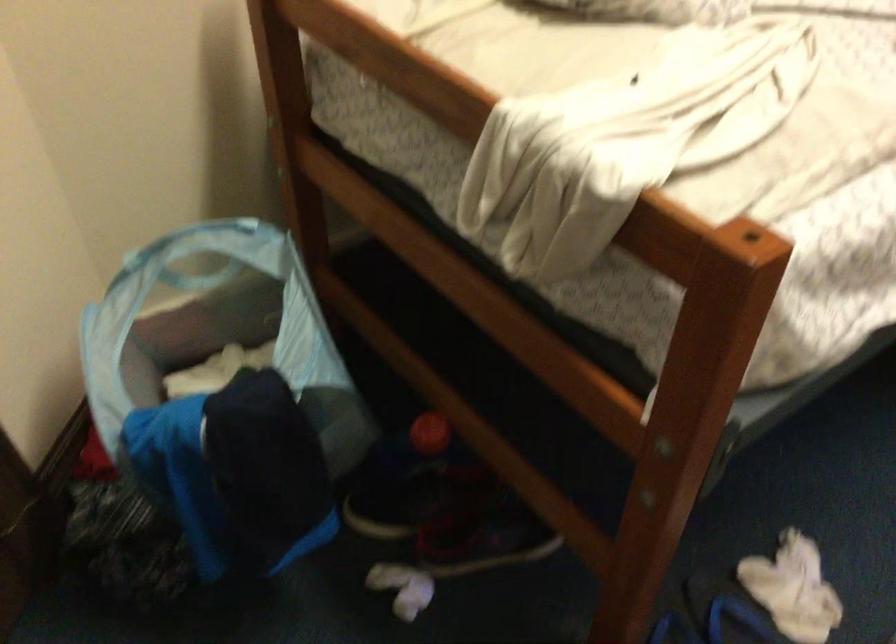
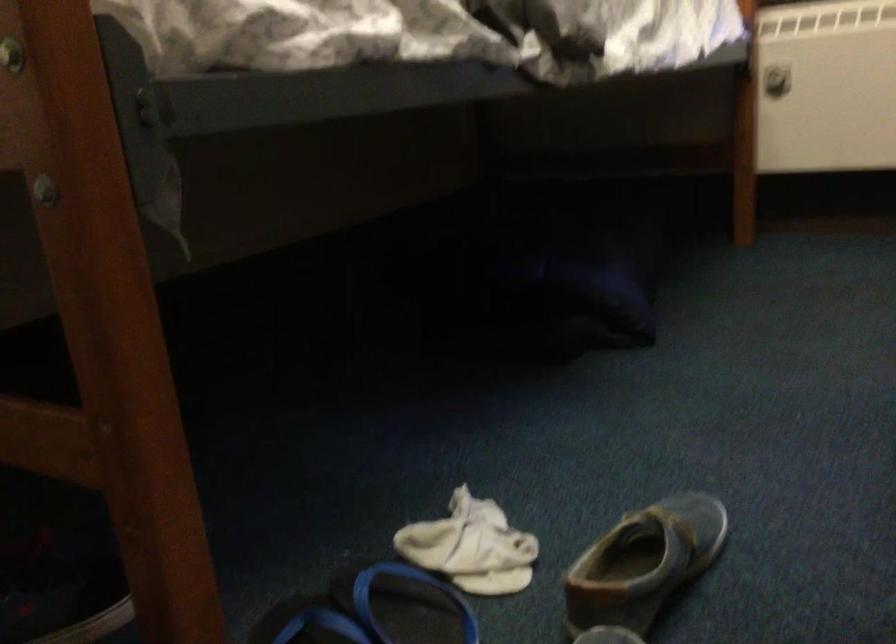
Looking at this image, how did the camera likely rotate?

The rotation direction of the camera is right-up.